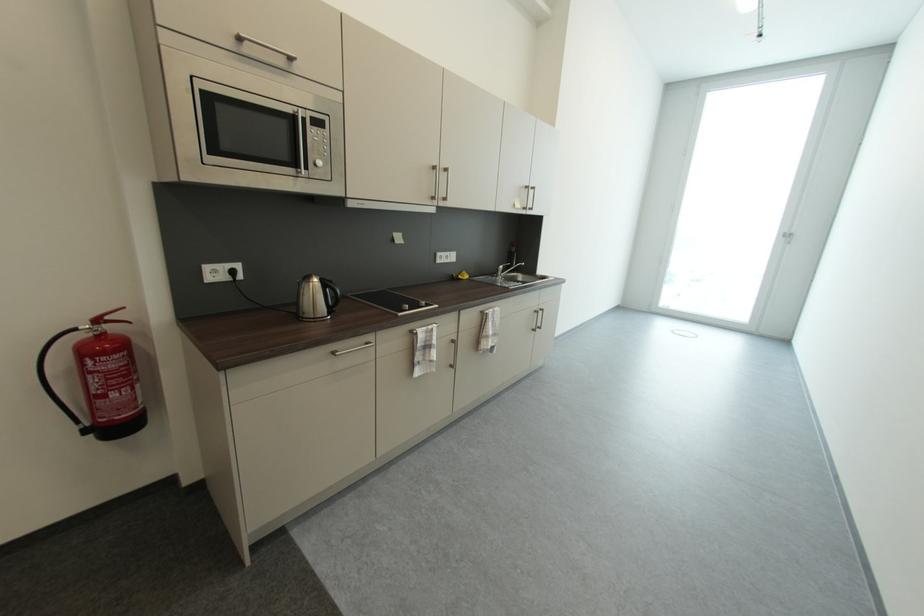
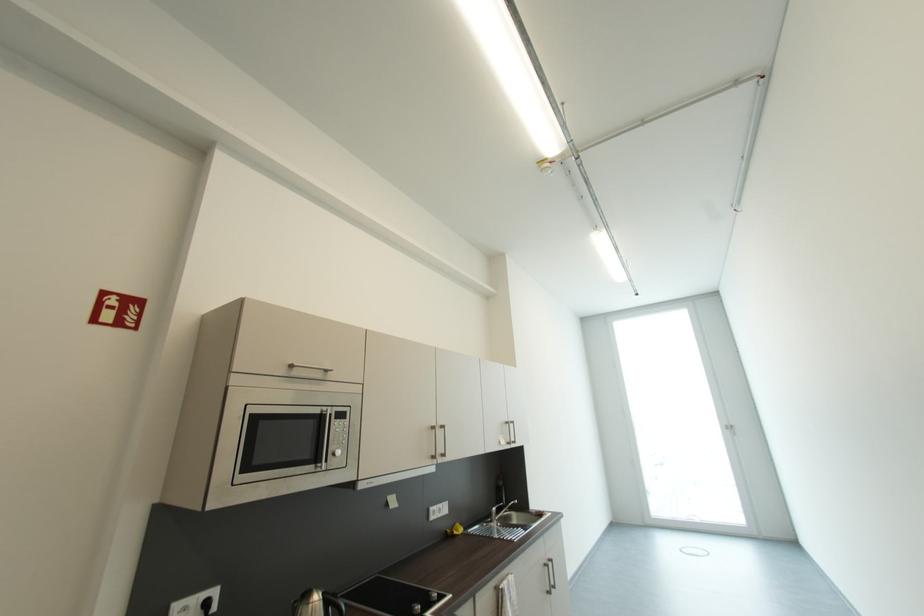
Locate, in the second image, the point that corresponds to [440,197] in the first image.

(440, 456)